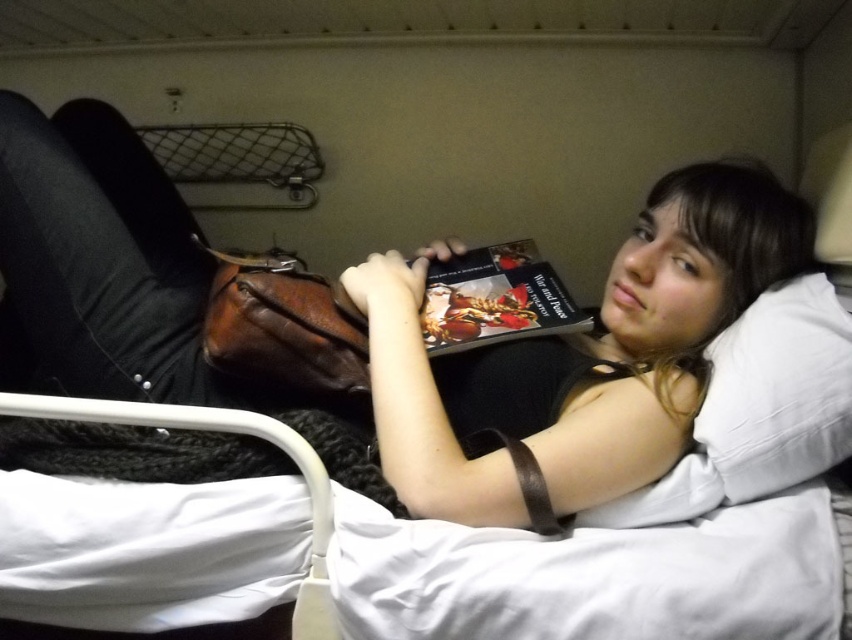
You are a photographer trying to capture a closeup of the book cover while avoiding the bag in the scene. The book is at point (x=778, y=337) and the bag is at point (x=571, y=320). Which point should you focus on to get the book in focus without the bag overlapping?

You should focus on point (x=778, y=337) because it is closer to the camera than point (x=571, y=320), allowing the book to be in focus while the bag is farther away and less likely to overlap.